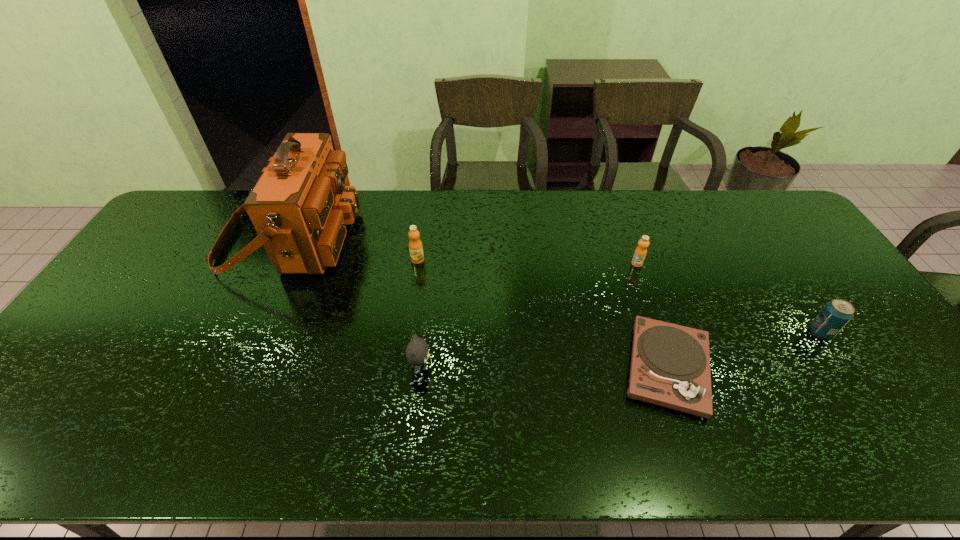
This screenshot has width=960, height=540. Identify the location of vacant area in the image that satisfies the following two spatial constraints: 1. on the front label of the shorter orange juice; 2. on the front-facing side of the kitten. (673, 367).